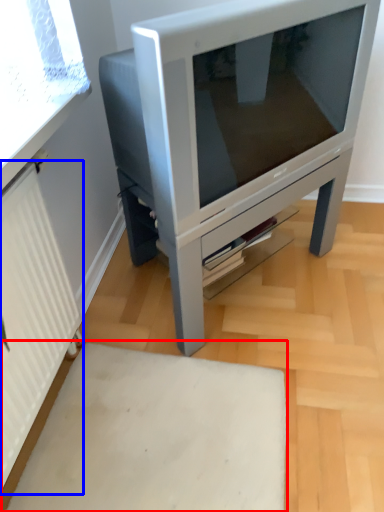
Question: Which object appears closest to the camera in this image, plain (highlighted by a red box) or radiator (highlighted by a blue box)?

Choices:
 (A) plain
 (B) radiator

Answer: (B)